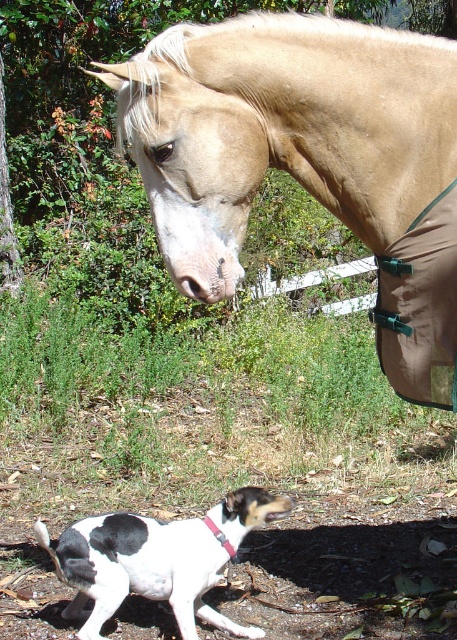
Does light brown horse at upper center appear under brown/cotton blanket at lower right?

No.

Is point (359, 163) positioned before point (396, 285)?

Yes, it is.

The height and width of the screenshot is (640, 457). What do you see at coordinates (308, 161) in the screenshot?
I see `light brown horse at upper center` at bounding box center [308, 161].

Identify the location of light brown horse at upper center. The image size is (457, 640). (308, 161).

Which is more to the left, light brown horse at upper center or black and white fur at lower left?

Positioned to the left is black and white fur at lower left.

Between light brown horse at upper center and black and white fur at lower left, which one has less height?

Standing shorter between the two is black and white fur at lower left.

Where is `light brown horse at upper center`? light brown horse at upper center is located at coordinates (308, 161).

Between black and white fur at lower left and brown/cotton blanket at lower right, which one appears on the left side from the viewer's perspective?

black and white fur at lower left

Locate an element on the screen. Image resolution: width=457 pixels, height=640 pixels. black and white fur at lower left is located at coordinates (158, 560).

Which is behind, point (85, 573) or point (378, 262)?

The point (378, 262) is behind.

This screenshot has width=457, height=640. In order to click on black and white fur at lower left in this screenshot , I will do `click(158, 560)`.